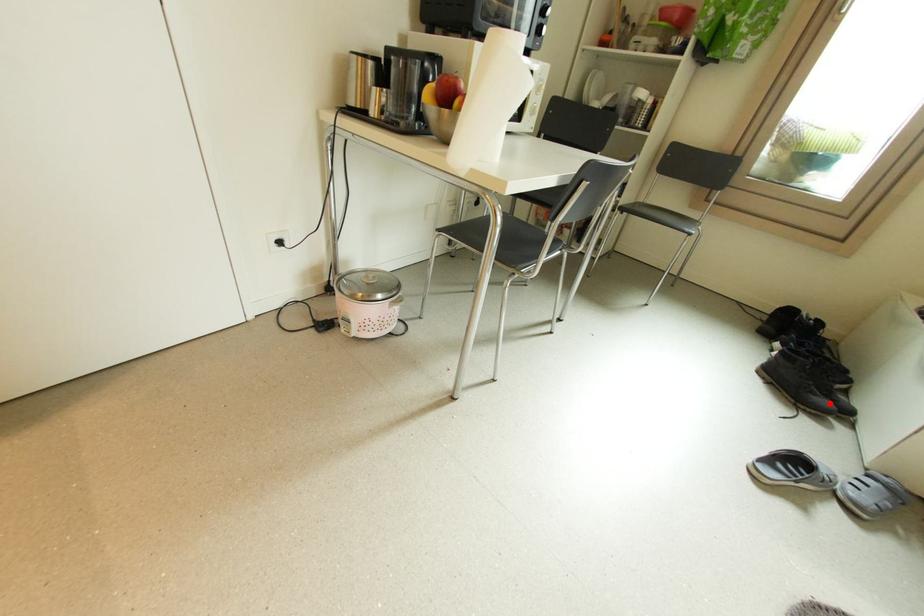
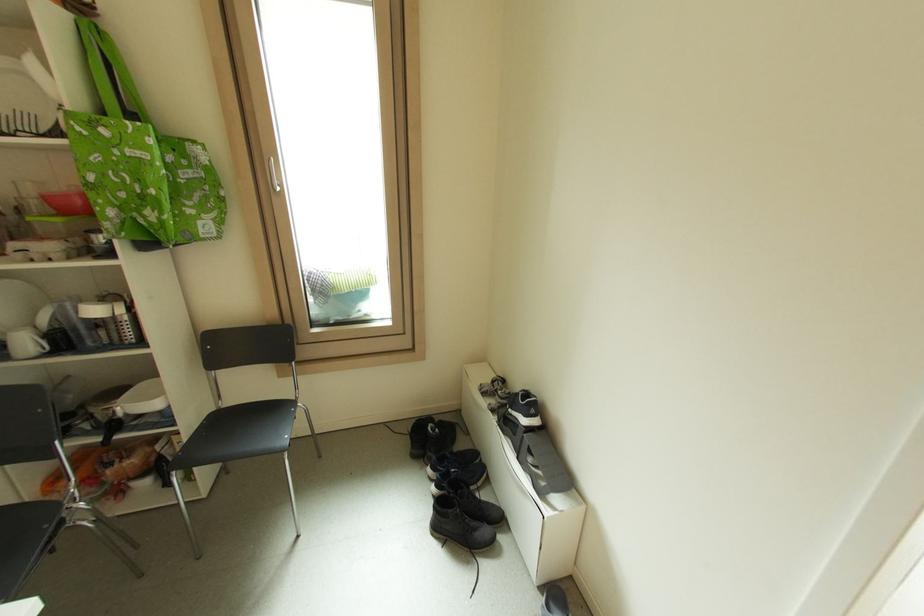
Find the pixel in the second image that matches the highlighted location in the first image.

(490, 532)